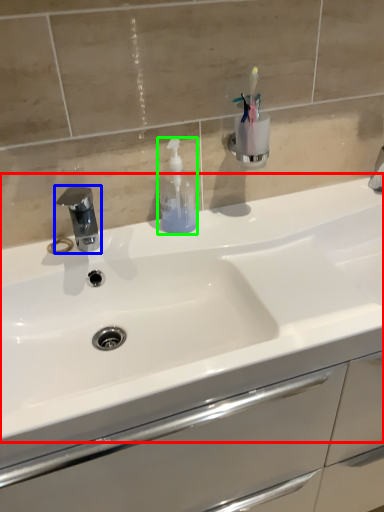
Question: Estimate the real-world distances between objects in this image. Which object is farther from sink (highlighted by a red box), tap (highlighted by a blue box) or soap dispenser (highlighted by a green box)?

Choices:
 (A) tap
 (B) soap dispenser

Answer: (A)